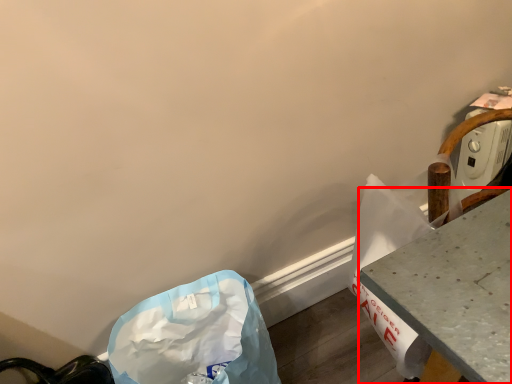
Question: From the image's perspective, where is table (annotated by the red box) located relative to plastic bag?

Choices:
 (A) above
 (B) below

Answer: (A)